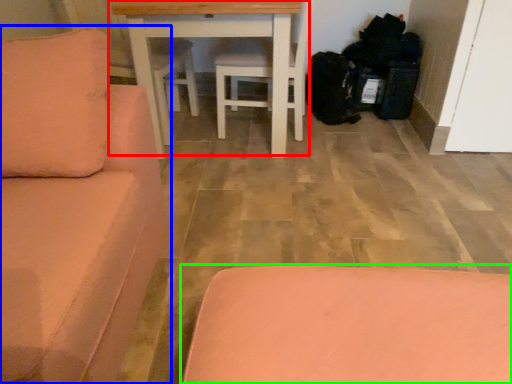
Question: Which object is the farthest from table (highlighted by a red box)? Choose among these: studio couch (highlighted by a blue box) or furniture (highlighted by a green box).

Choices:
 (A) studio couch
 (B) furniture

Answer: (B)